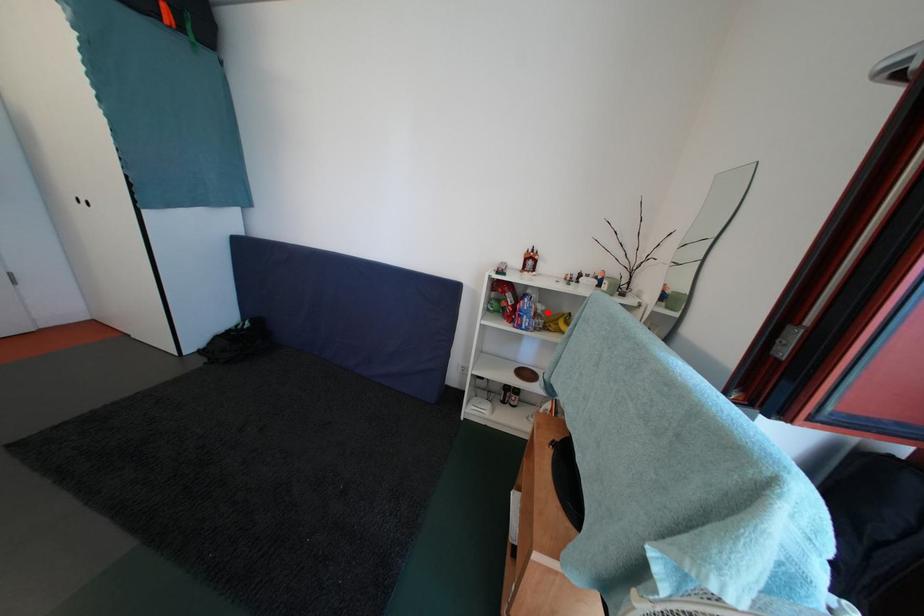
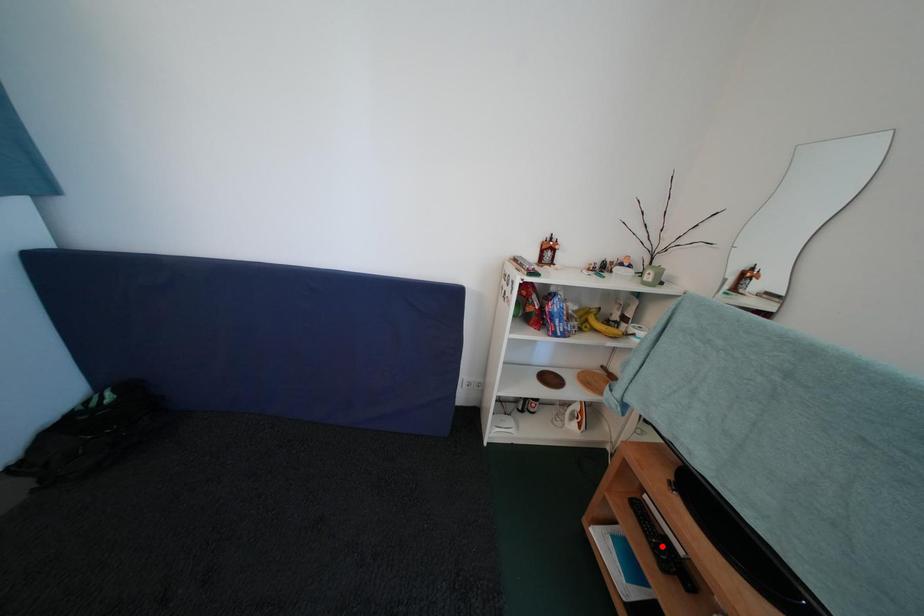
I am providing you with two images of the same scene from different viewpoints. A red point is marked on the first image and another point is marked on the second image. Are the points marked in image1 and image2 representing the same 3D position?

No